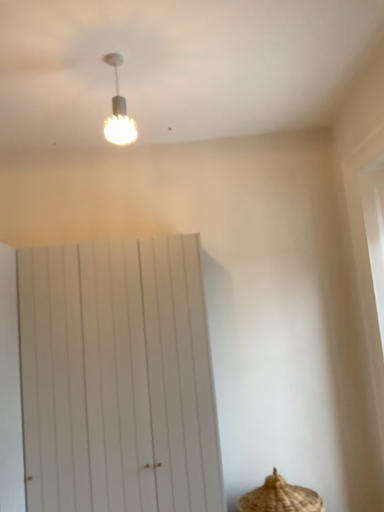
Question: Considering the positions of white textured bulb at upper center and white wooden barn door at center in the image, is white textured bulb at upper center taller or shorter than white wooden barn door at center?

Choices:
 (A) short
 (B) tall

Answer: (A)

Question: Is white textured bulb at upper center in front of or behind white wooden barn door at center in the image?

Choices:
 (A) front
 (B) behind

Answer: (A)

Question: Considering the real-world distances, which object is farthest from the white wooden barn door at center?

Choices:
 (A) brown woven basket at lower right
 (B) white textured bulb at upper center

Answer: (B)

Question: Considering the real-world distances, which object is farthest from the white wooden barn door at center?

Choices:
 (A) brown woven basket at lower right
 (B) white textured bulb at upper center

Answer: (B)